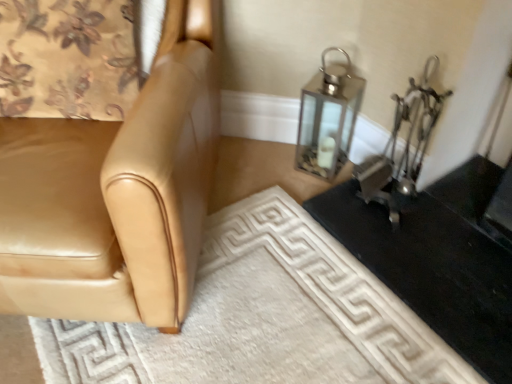
Question: Considering the relative sizes of metallic lantern at upper right and black glossy table at lower right in the image provided, is metallic lantern at upper right bigger than black glossy table at lower right?

Choices:
 (A) no
 (B) yes

Answer: (B)

Question: Could you tell me if metallic lantern at upper right is turned towards black glossy table at lower right?

Choices:
 (A) no
 (B) yes

Answer: (A)

Question: Is metallic lantern at upper right next to black glossy table at lower right and touching it?

Choices:
 (A) no
 (B) yes

Answer: (A)

Question: Is metallic lantern at upper right located outside black glossy table at lower right?

Choices:
 (A) no
 (B) yes

Answer: (B)

Question: From a real-world perspective, is metallic lantern at upper right under black glossy table at lower right?

Choices:
 (A) yes
 (B) no

Answer: (B)

Question: From a real-world perspective, is metallic lantern at upper right on black glossy table at lower right?

Choices:
 (A) no
 (B) yes

Answer: (B)

Question: From the image's perspective, is tan leather chair at left on top of floral fabric curtain at upper left?

Choices:
 (A) yes
 (B) no

Answer: (B)

Question: Can you confirm if tan leather chair at left is positioned to the left of floral fabric curtain at upper left?

Choices:
 (A) no
 (B) yes

Answer: (B)

Question: Can floral fabric curtain at upper left be found inside tan leather chair at left?

Choices:
 (A) no
 (B) yes

Answer: (B)

Question: Considering the relative positions of tan leather chair at left and floral fabric curtain at upper left in the image provided, is tan leather chair at left behind floral fabric curtain at upper left?

Choices:
 (A) no
 (B) yes

Answer: (A)

Question: Is tan leather chair at left bigger than floral fabric curtain at upper left?

Choices:
 (A) yes
 (B) no

Answer: (A)

Question: Can you confirm if tan leather chair at left is thinner than floral fabric curtain at upper left?

Choices:
 (A) yes
 (B) no

Answer: (B)

Question: From a real-world perspective, is floral fabric curtain at upper left under tan leather chair at left?

Choices:
 (A) yes
 (B) no

Answer: (B)